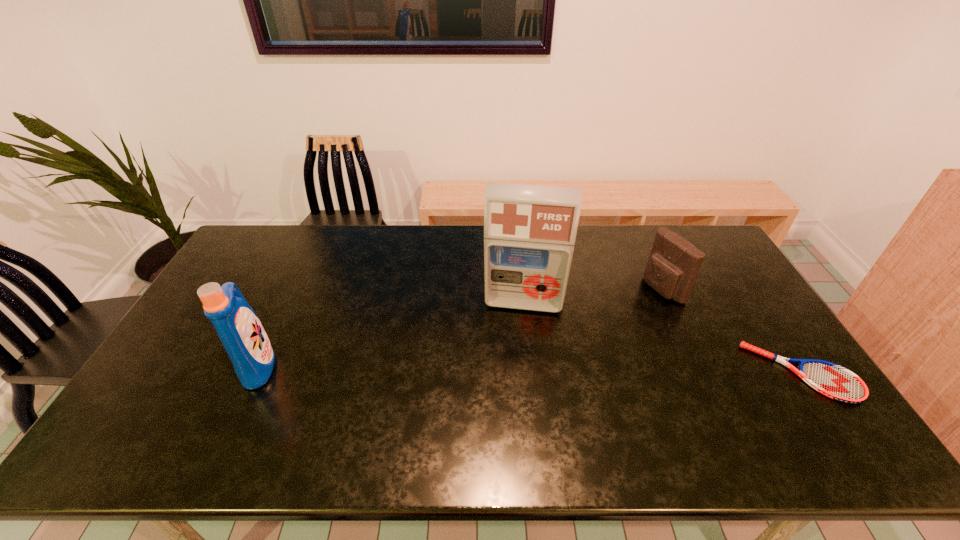
At what (x,y) coordinates should I click in order to perform the action: click on detergent. Please return your answer as a coordinate pair (x, y). The width and height of the screenshot is (960, 540). Looking at the image, I should click on (238, 327).

You are a GUI agent. You are given a task and a screenshot of the screen. Output one action in this format:
    pyautogui.click(x=<x>, y=<y>)
    Task: Click on the third shortest object
    Image resolution: width=960 pixels, height=540 pixels.
    Given the screenshot: What is the action you would take?
    pyautogui.click(x=238, y=327)

This screenshot has width=960, height=540. What are the coordinates of `the rightmost object` in the screenshot? It's located at 834,381.

At what (x,y) coordinates should I click in order to perform the action: click on the shortest object. Please return your answer as a coordinate pair (x, y). This screenshot has width=960, height=540. Looking at the image, I should click on (834, 381).

Locate an element on the screen. the first-aid kit is located at coordinates (529, 231).

Where is `the third object from right to left`? the third object from right to left is located at coordinates (529, 231).

The height and width of the screenshot is (540, 960). In order to click on the third tallest object in this screenshot , I will do `click(673, 265)`.

At what (x,y) coordinates should I click in order to perform the action: click on the second object from right to left. Please return your answer as a coordinate pair (x, y). The width and height of the screenshot is (960, 540). Looking at the image, I should click on (673, 265).

Find the location of a particular element. vacant space situated 0.280m on the label of the leftmost object is located at coordinates (378, 364).

Locate an element on the screen. The height and width of the screenshot is (540, 960). vacant region located 0.250m on the left of the rightmost object is located at coordinates (660, 373).